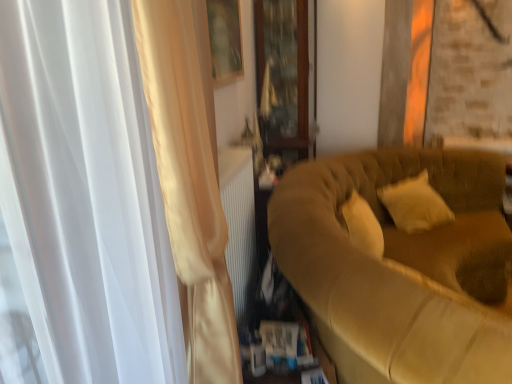
Question: Looking at the image, does transparent wooden cabinet at center seem bigger or smaller compared to soft white pillow at right?

Choices:
 (A) big
 (B) small

Answer: (A)

Question: From the image's perspective, is transparent wooden cabinet at center above or below soft white pillow at right?

Choices:
 (A) below
 (B) above

Answer: (B)

Question: Estimate the real-world distances between objects in this image. Which object is farther from the satin white curtain at left?

Choices:
 (A) soft white pillow at right
 (B) transparent wooden cabinet at center
 (C) suede-like beige couch at right

Answer: (B)

Question: Which object is positioned farthest from the suede-like beige couch at right?

Choices:
 (A) satin white curtain at left
 (B) transparent wooden cabinet at center
 (C) soft white pillow at right

Answer: (B)